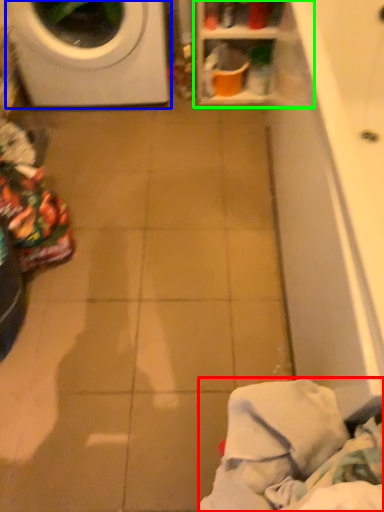
Question: Which object is the closest to the clothing (highlighted by a red box)? Choose among these: washing machine (highlighted by a blue box) or shelf (highlighted by a green box).

Choices:
 (A) washing machine
 (B) shelf

Answer: (B)